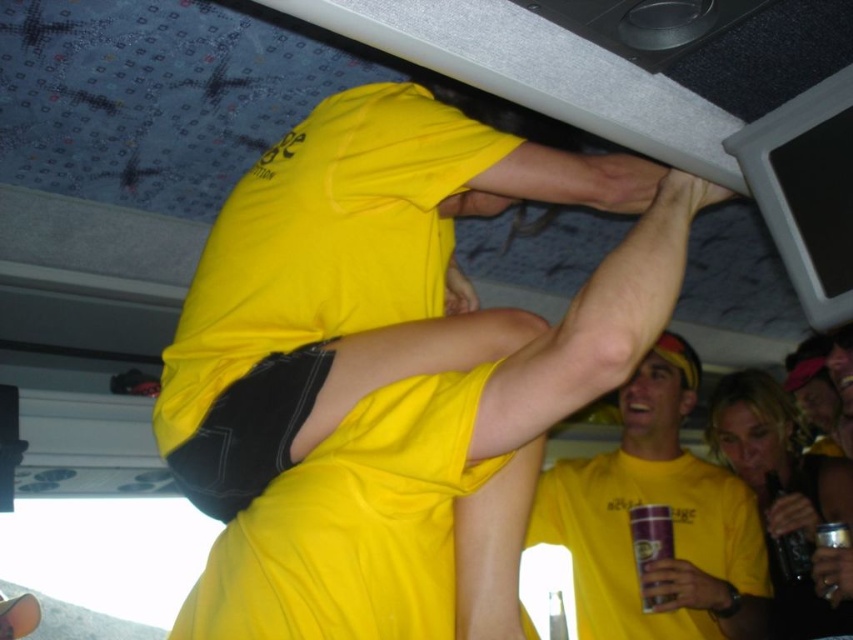
Question: Can you confirm if yellow matte t-shirt at upper center is smaller than purple plastic cup at lower center?

Choices:
 (A) yes
 (B) no

Answer: (B)

Question: Among these objects, which one is nearest to the camera?

Choices:
 (A) purple plastic cup at lower center
 (B) yellow matte t-shirt at upper center
 (C) black glass bottle at lower right

Answer: (B)

Question: Is yellow matte t-shirt at upper center to the right of purple plastic cup at lower center from the viewer's perspective?

Choices:
 (A) yes
 (B) no

Answer: (B)

Question: Is matte yellow t-shirt at upper center positioned at the back of black glass bottle at lower right?

Choices:
 (A) no
 (B) yes

Answer: (A)

Question: Among these points, which one is nearest to the camera?

Choices:
 (A) (795, 545)
 (B) (201, 378)

Answer: (B)

Question: Among these objects, which one is nearest to the camera?

Choices:
 (A) matte yellow t-shirt at upper center
 (B) purple plastic cup at lower center
 (C) black glass bottle at lower right
 (D) yellow matte t-shirt at upper center

Answer: (D)